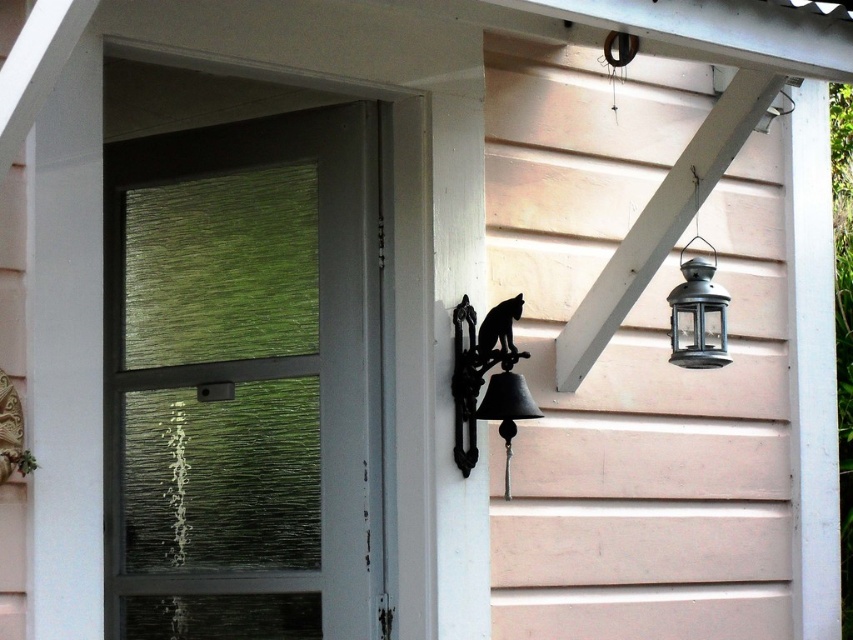
Question: Which of these objects is positioned closest to the metallic lantern at upper right?

Choices:
 (A) black metal bell at center
 (B) black wrought iron bell at center
 (C) green frosted glass window at left

Answer: (A)

Question: Which of these objects is positioned closest to the metallic lantern at upper right?

Choices:
 (A) green frosted glass window at left
 (B) black metal bell at center

Answer: (B)

Question: Based on their relative distances, which object is farther from the metallic lantern at upper right?

Choices:
 (A) black metal bell at center
 (B) black wrought iron bell at center

Answer: (B)

Question: Does black wrought iron bell at center have a smaller size compared to metallic lantern at upper right?

Choices:
 (A) yes
 (B) no

Answer: (A)

Question: Does green frosted glass window at left have a smaller size compared to metallic lantern at upper right?

Choices:
 (A) yes
 (B) no

Answer: (B)

Question: Can you confirm if metallic lantern at upper right is smaller than black metal bell at center?

Choices:
 (A) no
 (B) yes

Answer: (A)